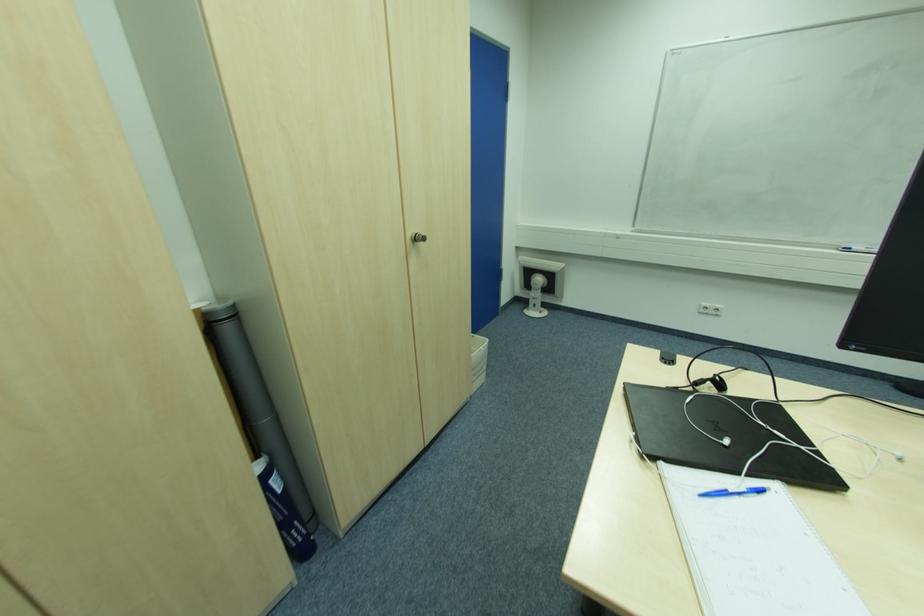
Find where to lift the white spiral notebook. Please return your answer as a coordinate pair (x, y).

(754, 549)